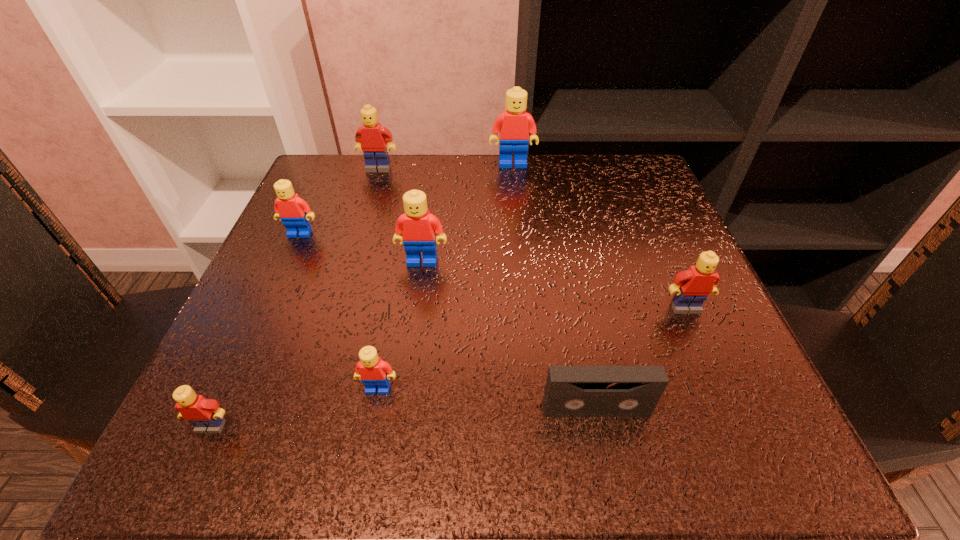
You are a GUI agent. You are given a task and a screenshot of the screen. Output one action in this format:
    pyautogui.click(x=<x>, y=<y>)
    Task: Click on the smallest red Lego
    
    Given the screenshot: What is the action you would take?
    pyautogui.click(x=373, y=371)

What are the coordinates of `the sixth farthest object` in the screenshot? It's located at (373, 371).

Image resolution: width=960 pixels, height=540 pixels. Find the location of `the smallest yellow Lego`. the smallest yellow Lego is located at coordinates (206, 415).

Locate an element on the screen. the nearest object is located at coordinates (206, 415).

The width and height of the screenshot is (960, 540). I want to click on the seventh farthest object, so click(571, 391).

Locate an element on the screen. This screenshot has width=960, height=540. vacant space situated on the face of the tallest Lego is located at coordinates (518, 220).

The width and height of the screenshot is (960, 540). I want to click on blank space located on the front-facing side of the biggest yellow Lego, so click(x=345, y=282).

Locate an element on the screen. free location located 0.160m on the face of the third smallest red Lego is located at coordinates (412, 341).

You are a GUI agent. You are given a task and a screenshot of the screen. Output one action in this format:
    pyautogui.click(x=<x>, y=<y>)
    Task: Click on the vacant space located 0.070m on the front-facing side of the rightmost yellow Lego
    The image size is (960, 540).
    Given the screenshot: What is the action you would take?
    pyautogui.click(x=704, y=350)

At what (x,y) coordinates should I click in order to perform the action: click on vacant space located 0.380m on the face of the second farthest red Lego. Please return your answer as a coordinate pair (x, y). Looking at the image, I should click on (213, 426).